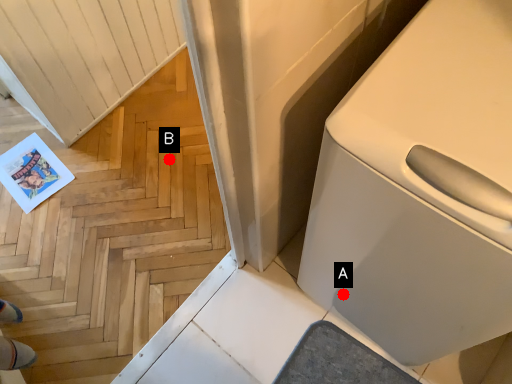
Question: Two points are circled on the image, labeled by A and B beside each circle. Among these points, which one is nearest to the camera?

Choices:
 (A) A is closer
 (B) B is closer

Answer: (A)